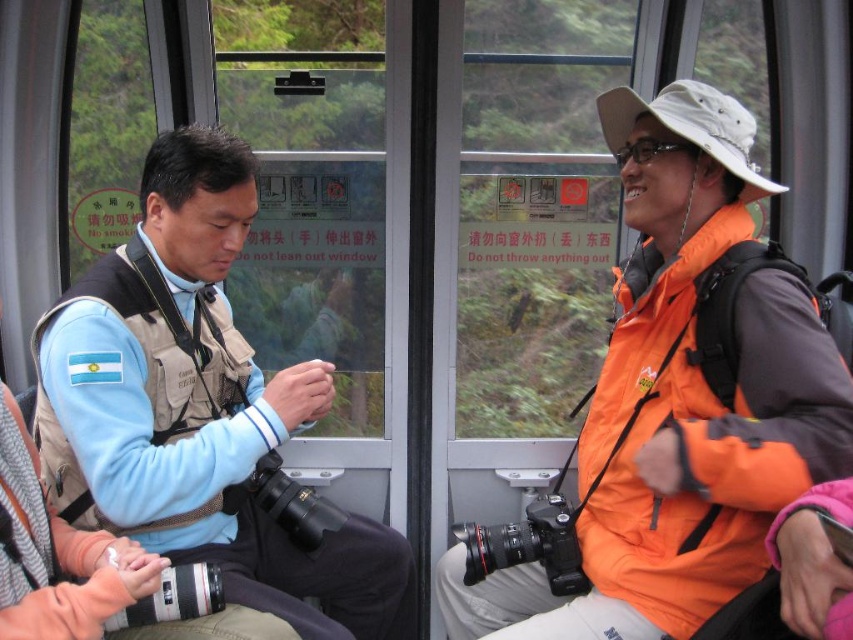
Does orange matte jacket at right have a smaller size compared to light blue fabric jacket at left?

Correct, orange matte jacket at right occupies less space than light blue fabric jacket at left.

Between orange matte jacket at right and light blue fabric jacket at left, which one has less height?

With less height is light blue fabric jacket at left.

Who is more distant from viewer, (461,566) or (259,608)?

The point (461,566) is behind.

At what (x,y) coordinates should I click in order to perform the action: click on orange matte jacket at right. Please return your answer as a coordinate pair (x, y). Looking at the image, I should click on (679, 401).